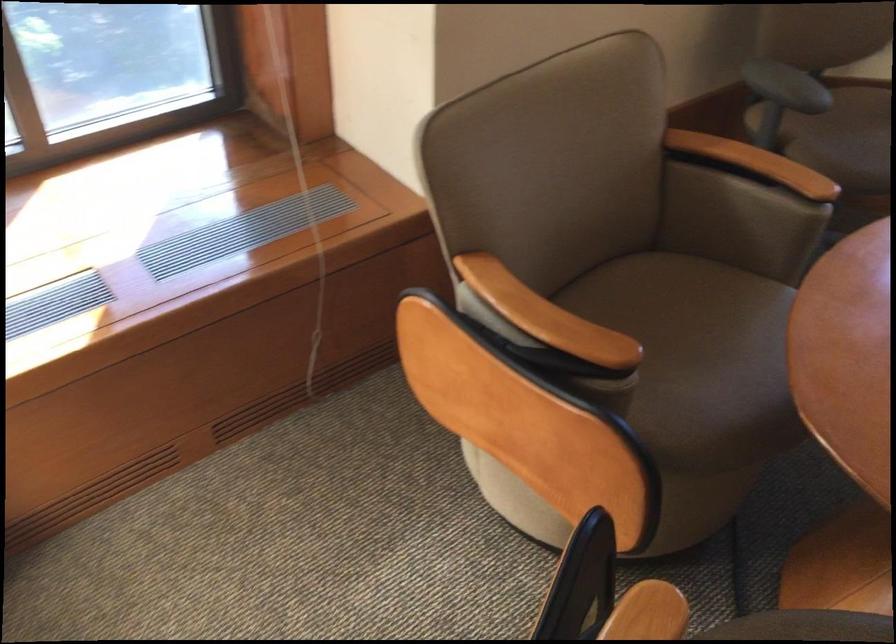
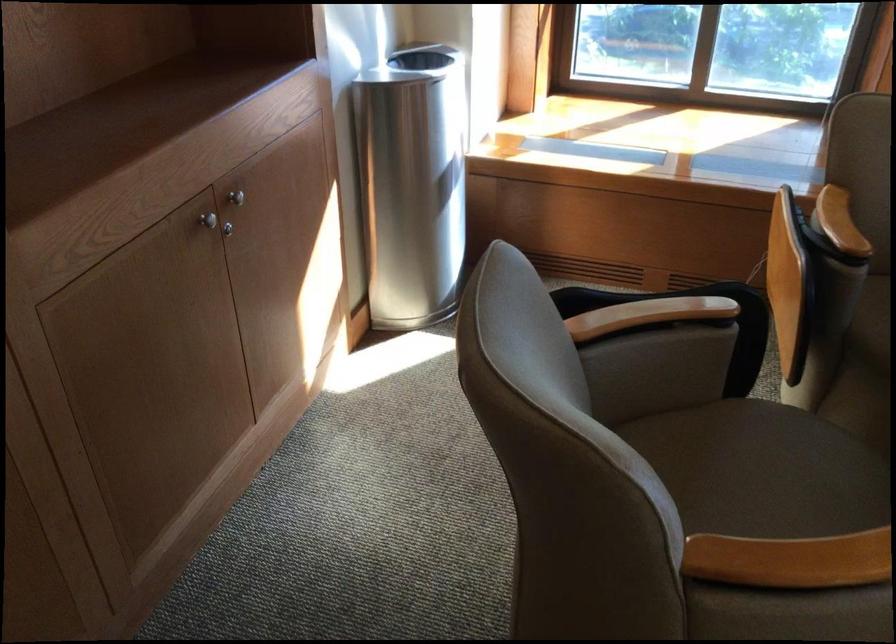
The point at [541,317] is marked in the first image. Where is the corresponding point in the second image?

(839, 222)